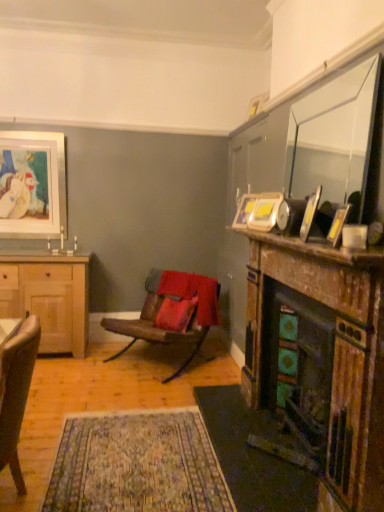
Question: Considering the relative sizes of light brown wooden cabinet at left and velvet beige armchair at lower left, which ranks as the 2th chair in back-to-front order, in the image provided, is light brown wooden cabinet at left shorter than velvet beige armchair at lower left, which ranks as the 2th chair in back-to-front order,?

Choices:
 (A) yes
 (B) no

Answer: (B)

Question: Is light brown wooden cabinet at left outside of velvet beige armchair at lower left, which ranks as the 2th chair in back-to-front order?

Choices:
 (A) no
 (B) yes

Answer: (B)

Question: Is the surface of light brown wooden cabinet at left in direct contact with velvet beige armchair at lower left, which is counted as the first chair, starting from the front?

Choices:
 (A) no
 (B) yes

Answer: (A)

Question: From a real-world perspective, is light brown wooden cabinet at left located beneath velvet beige armchair at lower left, which ranks as the 2th chair in back-to-front order?

Choices:
 (A) yes
 (B) no

Answer: (B)

Question: From the image's perspective, would you say light brown wooden cabinet at left is shown under velvet beige armchair at lower left, which is counted as the first chair, starting from the front?

Choices:
 (A) yes
 (B) no

Answer: (B)

Question: Considering the relative sizes of light brown wooden cabinet at left and velvet beige armchair at lower left, which is counted as the first chair, starting from the front, in the image provided, is light brown wooden cabinet at left taller than velvet beige armchair at lower left, which is counted as the first chair, starting from the front,?

Choices:
 (A) yes
 (B) no

Answer: (A)

Question: Is metallic silver picture frame at upper right, the 3th picture frame viewed from the front, at the left side of matte white picture frame at upper left, the 1th picture frame when ordered from left to right?

Choices:
 (A) yes
 (B) no

Answer: (B)

Question: From a real-world perspective, is metallic silver picture frame at upper right, the third picture frame from the back, physically above matte white picture frame at upper left, the 1th picture frame when ordered from left to right?

Choices:
 (A) yes
 (B) no

Answer: (B)

Question: Is metallic silver picture frame at upper right, positioned as the 3th picture frame in right-to-left order, directly adjacent to matte white picture frame at upper left, acting as the 1th picture frame starting from the back?

Choices:
 (A) yes
 (B) no

Answer: (B)

Question: Is matte white picture frame at upper left, marked as the 5th picture frame in a right-to-left arrangement, a part of metallic silver picture frame at upper right, placed as the 3th picture frame when sorted from left to right?

Choices:
 (A) yes
 (B) no

Answer: (B)

Question: Can you confirm if metallic silver picture frame at upper right, positioned as the 3th picture frame in right-to-left order, is wider than matte white picture frame at upper left, acting as the 1th picture frame starting from the back?

Choices:
 (A) yes
 (B) no

Answer: (A)

Question: Is metallic silver picture frame at upper right, the 3th picture frame viewed from the front, thinner than matte white picture frame at upper left, which ranks as the fifth picture frame in front-to-back order?

Choices:
 (A) yes
 (B) no

Answer: (B)

Question: Considering the relative sizes of clear glass mirror at upper right and wooden mantelpiece at right in the image provided, is clear glass mirror at upper right wider than wooden mantelpiece at right?

Choices:
 (A) no
 (B) yes

Answer: (A)